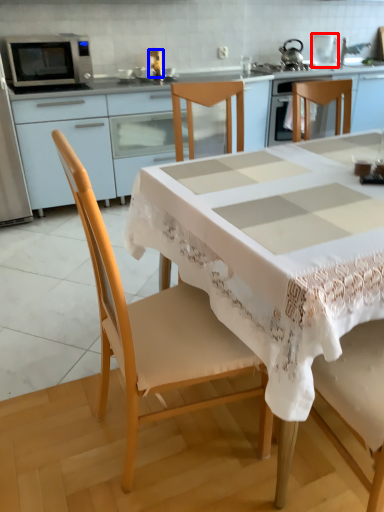
Question: Which object appears farthest to the camera in this image, appliance (highlighted by a red box) or appliance (highlighted by a blue box)?

Choices:
 (A) appliance
 (B) appliance

Answer: (A)